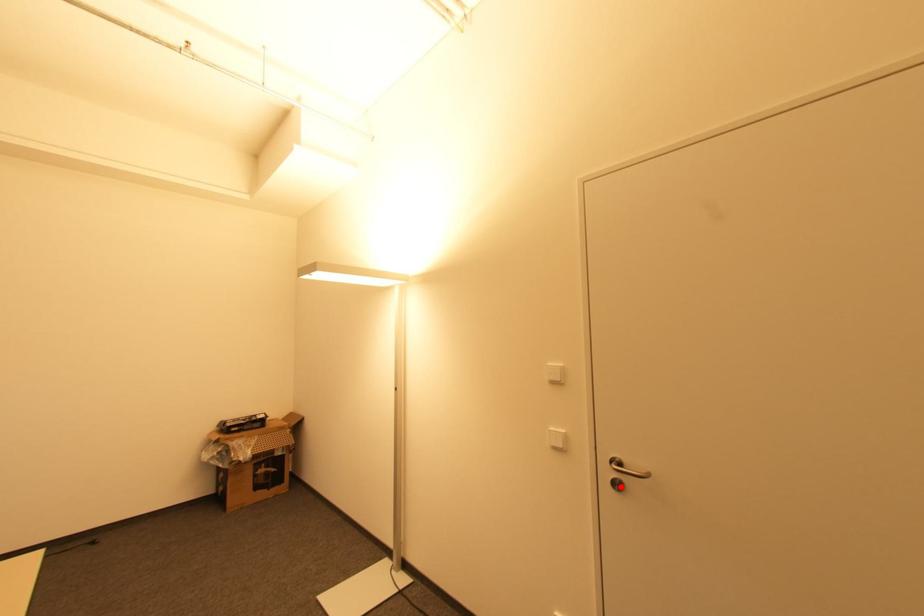
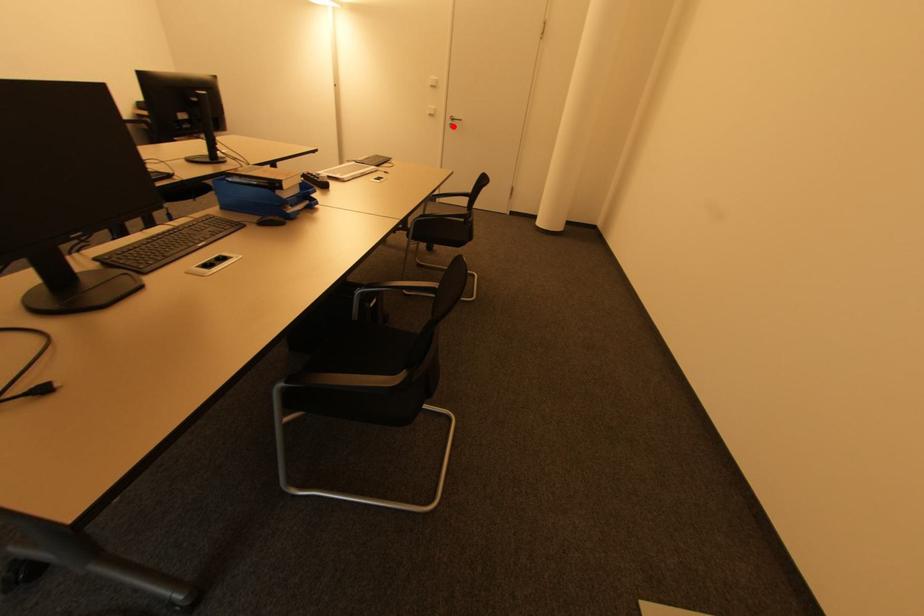
Based on the photo, I am providing you with two images of the same scene from different viewpoints. A red point is marked on the first image and another point is marked on the second image. Is the marked point in image1 the same physical position as the marked point in image2?

Yes